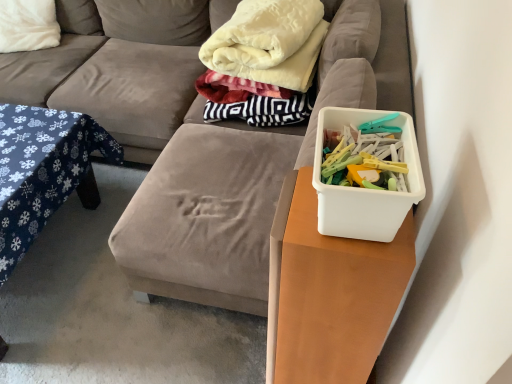
Question: Based on their sizes in the image, would you say velvety white blanket at upper center is bigger or smaller than velvet fabric couch at center?

Choices:
 (A) big
 (B) small

Answer: (B)

Question: From a real-world perspective, is velvety white blanket at upper center above or below velvet fabric couch at center?

Choices:
 (A) below
 (B) above

Answer: (B)

Question: Which of these objects is positioned farthest from the velvety white blanket at upper center?

Choices:
 (A) white plastic container at right
 (B) velvet fabric couch at center
 (C) white soft pillow at upper left
 (D) blue fabric table at left

Answer: (C)

Question: Based on their relative distances, which object is farther from the white soft pillow at upper left?

Choices:
 (A) white plastic container at right
 (B) velvety white blanket at upper center
 (C) blue fabric table at left
 (D) velvet fabric couch at center

Answer: (A)